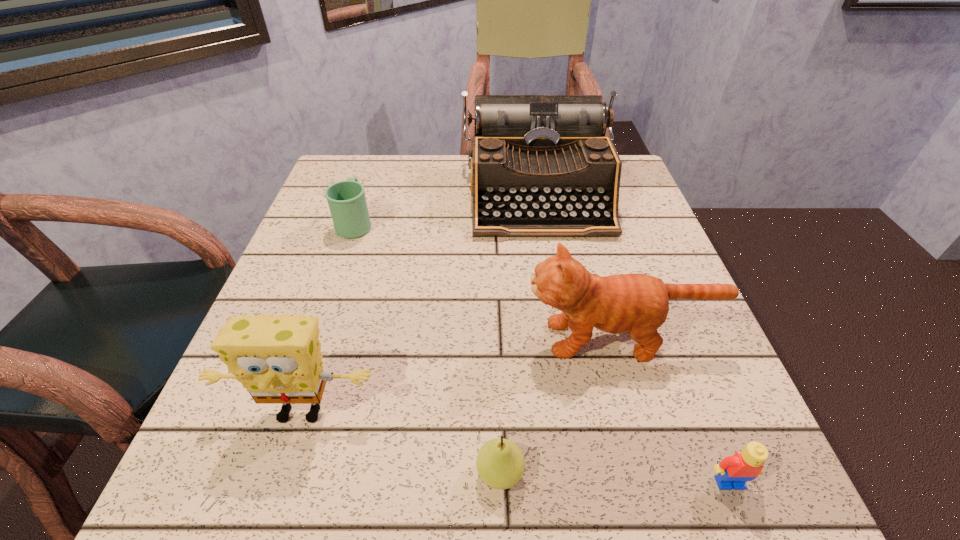
You are a GUI agent. You are given a task and a screenshot of the screen. Output one action in this format:
    pyautogui.click(x=<x>, y=<y>)
    Task: Click on the vacant point located 0.060m on the side of the mug with the handle
    The width and height of the screenshot is (960, 540).
    Given the screenshot: What is the action you would take?
    pyautogui.click(x=365, y=194)

This screenshot has width=960, height=540. I want to click on free location located on the side of the mug with the handle, so click(367, 190).

What are the coordinates of `vacant area situated 0.220m on the side of the mug with the handle` in the screenshot? It's located at (376, 162).

Where is `free space located on the right of the pear`? This screenshot has width=960, height=540. free space located on the right of the pear is located at coordinates tap(732, 473).

Where is `object present at the far edge`? Image resolution: width=960 pixels, height=540 pixels. object present at the far edge is located at coordinates (541, 166).

At what (x,y) coordinates should I click in order to perform the action: click on Lego that is at the near edge. Please return your answer as a coordinate pair (x, y). This screenshot has height=540, width=960. Looking at the image, I should click on (734, 471).

I want to click on pear located at the near edge, so 500,463.

This screenshot has height=540, width=960. In order to click on sponge located in the left edge section of the desktop in this screenshot , I will do `click(278, 359)`.

Locate an element on the screen. Image resolution: width=960 pixels, height=540 pixels. mug located in the left edge section of the desktop is located at coordinates (346, 199).

The height and width of the screenshot is (540, 960). I want to click on typewriter at the right edge, so click(541, 166).